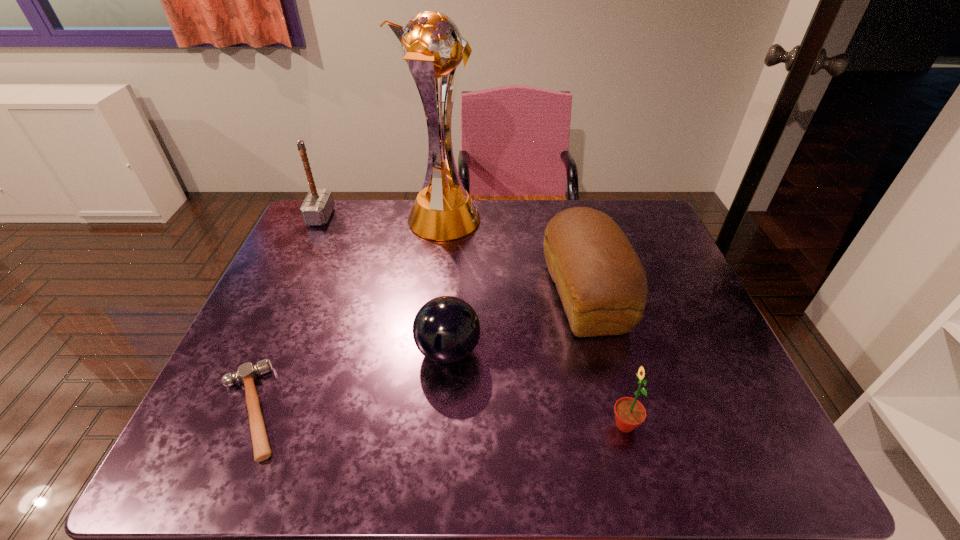
Find the location of a particular element. free space that is in between the trophy and the bowling ball is located at coordinates (445, 286).

Where is `vacant space that is in between the bread and the trophy`? vacant space that is in between the bread and the trophy is located at coordinates 514,258.

Find the location of `free spot between the shortest object and the taller hammer`. free spot between the shortest object and the taller hammer is located at coordinates (286, 313).

In order to click on vacant area between the shortest object and the sunflower in this screenshot , I will do `click(438, 417)`.

Locate an element on the screen. This screenshot has width=960, height=540. object that is the third closest to the sunflower is located at coordinates (431, 44).

Locate an element on the screen. the closest object to the bread is located at coordinates (629, 413).

Where is `free space that satisfies the following two spatial constraints: 1. on the back side of the bread; 2. on the left side of the shorter hammer`? free space that satisfies the following two spatial constraints: 1. on the back side of the bread; 2. on the left side of the shorter hammer is located at coordinates (300, 295).

This screenshot has height=540, width=960. I want to click on vacant space that satisfies the following two spatial constraints: 1. on the striking surface of the second tallest object; 2. on the right side of the bread, so click(x=284, y=295).

Find the location of a particular element. Image resolution: width=960 pixels, height=540 pixels. vacant space that satisfies the following two spatial constraints: 1. on the front-facing side of the tallest object; 2. on the back side of the bread is located at coordinates (434, 295).